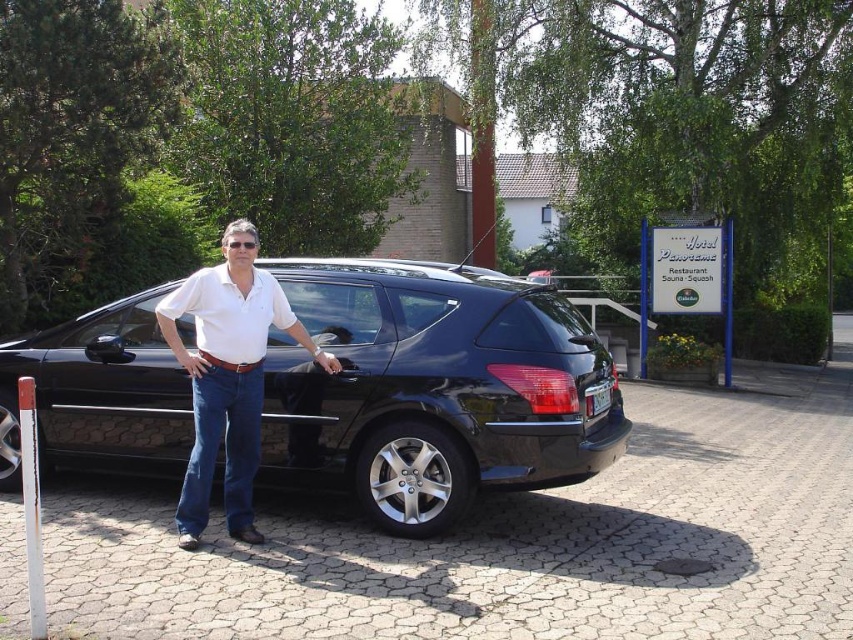
Is point (332, 401) in front of point (598, 385)?

Yes, point (332, 401) is closer to viewer.

Locate an element on the screen. The image size is (853, 640). glossy black car at center is located at coordinates (434, 387).

Who is lower down, glossy black car at center or white cotton shirt at center?

white cotton shirt at center is below.

Which is more to the right, glossy black car at center or white cotton shirt at center?

Positioned to the right is glossy black car at center.

Locate an element on the screen. glossy black car at center is located at coordinates (434, 387).

At what (x,y) coordinates should I click in order to perform the action: click on glossy black car at center. Please return your answer as a coordinate pair (x, y). The image size is (853, 640). Looking at the image, I should click on (434, 387).

Is white cotton shirt at center positioned before white plastic license plate at rear?

Yes, white cotton shirt at center is in front of white plastic license plate at rear.

Measure the distance between point [276,317] and camera.

They are 4.97 meters apart.

Image resolution: width=853 pixels, height=640 pixels. In order to click on white cotton shirt at center in this screenshot , I will do `click(228, 376)`.